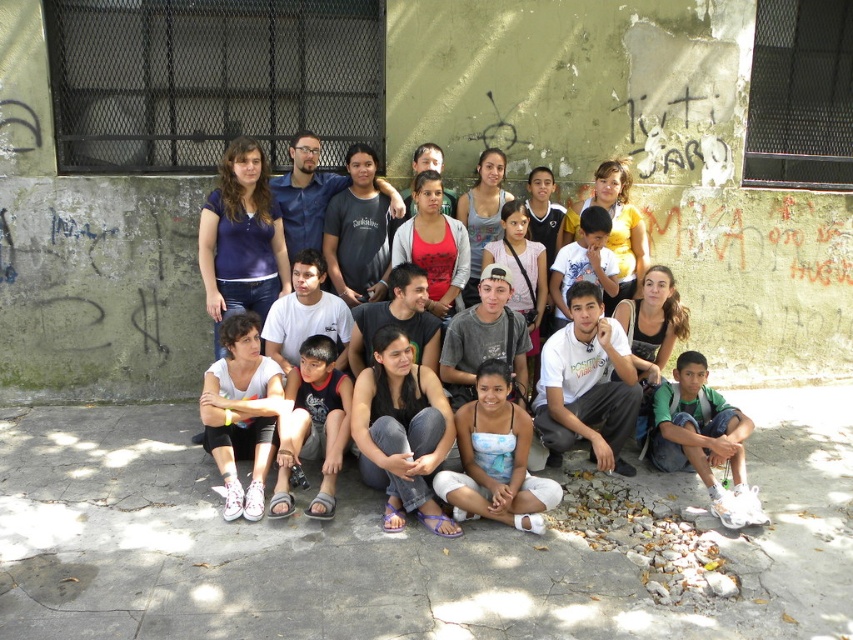
Question: Is jeans at center to the right of blue printed tank top at center from the viewer's perspective?

Choices:
 (A) no
 (B) yes

Answer: (A)

Question: Which object is farther from the camera taking this photo?

Choices:
 (A) white fabric shirt at lower left
 (B) blue printed tank top at center

Answer: (A)

Question: Which of the following is the closest to the observer?

Choices:
 (A) (476, 433)
 (B) (444, 515)
 (C) (238, 387)

Answer: (B)

Question: Does blue printed tank top at center appear over white fabric shirt at lower left?

Choices:
 (A) no
 (B) yes

Answer: (A)

Question: Which object is closer to the camera taking this photo?

Choices:
 (A) white fabric shirt at lower left
 (B) blue printed tank top at center
 (C) jeans at center

Answer: (C)

Question: Can you confirm if jeans at center is thinner than blue printed tank top at center?

Choices:
 (A) no
 (B) yes

Answer: (B)